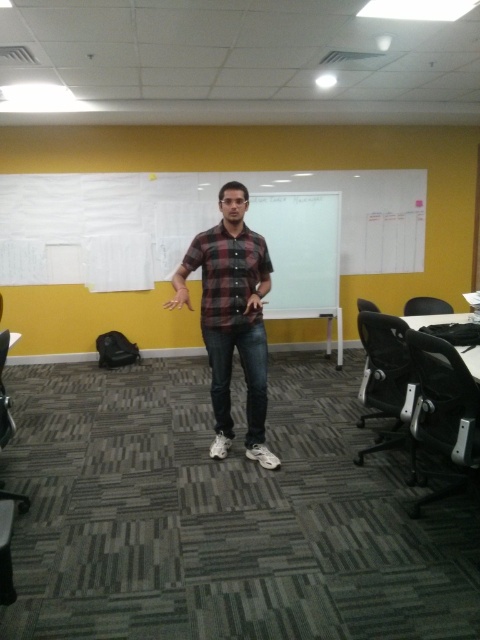
Is plaid shirt at center bigger than plaid cotton shirt at center?

Yes.

Does plaid shirt at center appear on the right side of plaid cotton shirt at center?

Incorrect, plaid shirt at center is not on the right side of plaid cotton shirt at center.

Does point (245, 209) lie behind point (215, 262)?

No, (245, 209) is closer to viewer.

Locate an element on the screen. This screenshot has width=480, height=640. plaid shirt at center is located at coordinates (231, 317).